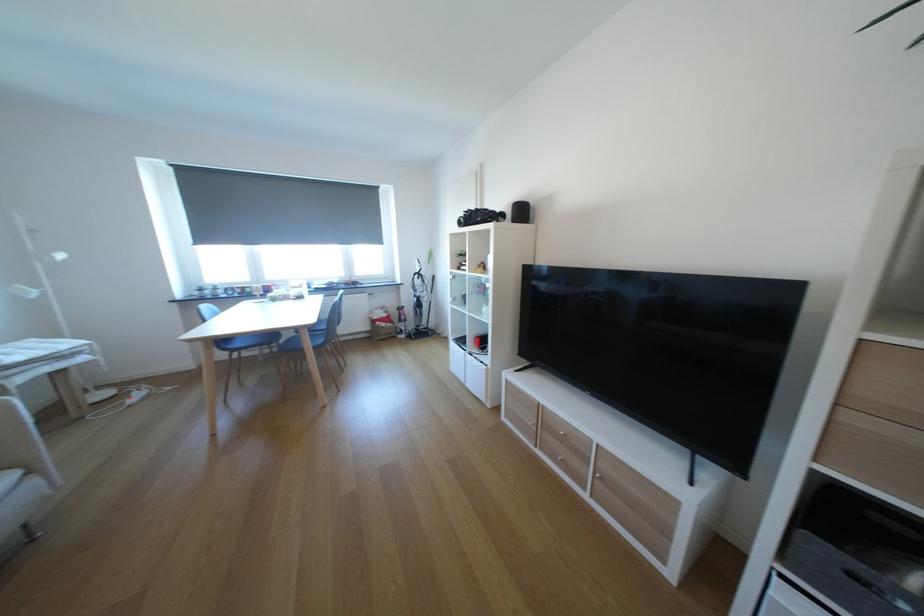
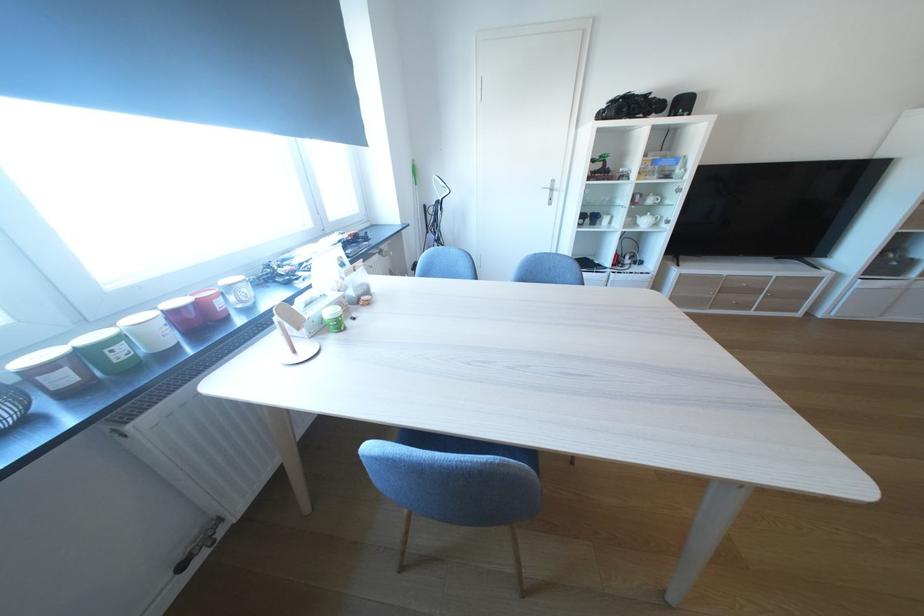
Locate, in the second image, the point that corresponds to [494,307] in the first image.

(648, 220)